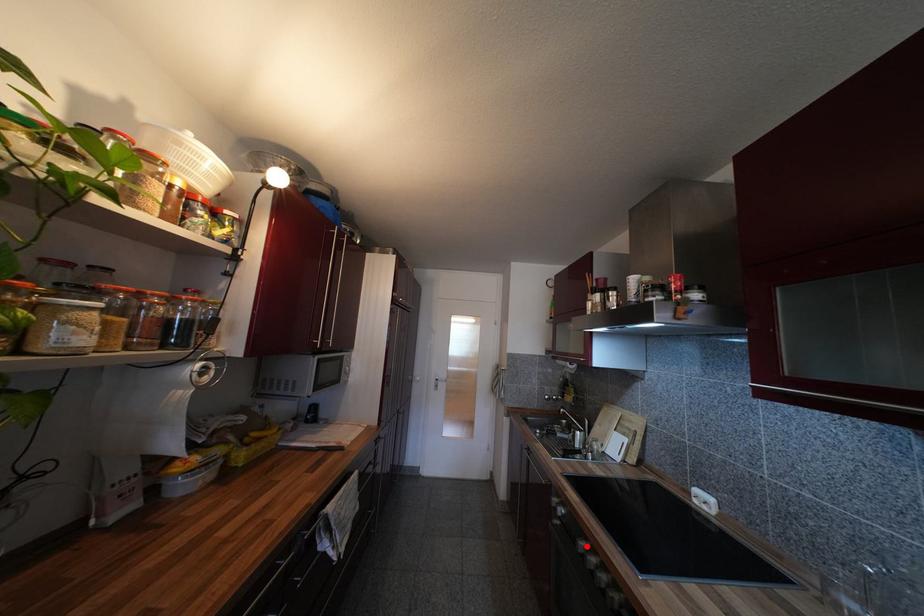
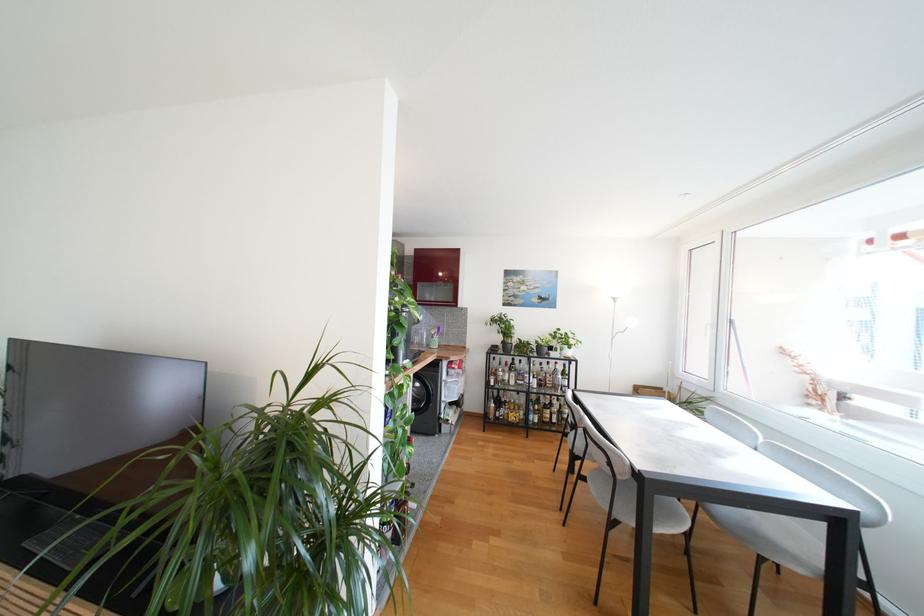
Question: I am providing you with two images of the same scene from different viewpoints. A red point is marked on the first image. At the location where the point appears in image 1, is it still visible in image 2?

Choices:
 (A) Yes
 (B) No

Answer: (B)